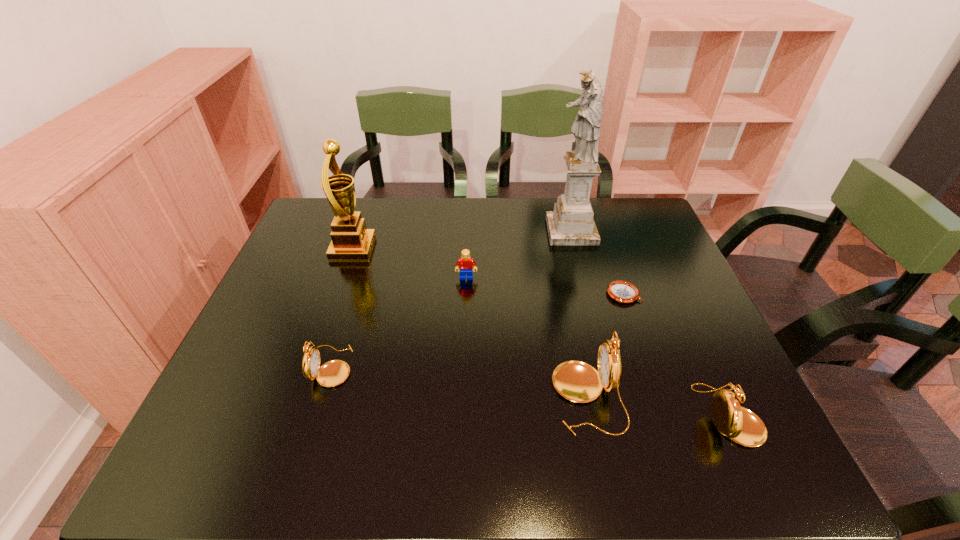
Locate an element on the screen. vacant region at the right edge of the desktop is located at coordinates (x=661, y=272).

Locate an element on the screen. The image size is (960, 540). free space at the far left corner of the desktop is located at coordinates (313, 223).

The width and height of the screenshot is (960, 540). What are the coordinates of `free region at the far right corner of the desktop` in the screenshot? It's located at 640,202.

Find the location of a particular element. This screenshot has height=540, width=960. vacant area that lies between the Lego and the sixth shortest object is located at coordinates (410, 263).

Locate an element on the screen. The image size is (960, 540). vacant region between the fifth object from right to left and the rightmost pocket watch is located at coordinates (597, 346).

Identify the location of free spot between the tallest object and the third farthest object. The height and width of the screenshot is (540, 960). (518, 254).

Locate an element on the screen. free space between the tallest object and the Lego is located at coordinates coord(518,254).

Where is `empty space that is in between the sixth shortest object and the second pocket watch from left to right`? empty space that is in between the sixth shortest object and the second pocket watch from left to right is located at coordinates (470, 322).

The width and height of the screenshot is (960, 540). I want to click on empty space that is in between the fifth object from right to left and the compass, so click(x=545, y=286).

Locate an element on the screen. The width and height of the screenshot is (960, 540). empty location between the sixth shortest object and the compass is located at coordinates (489, 271).